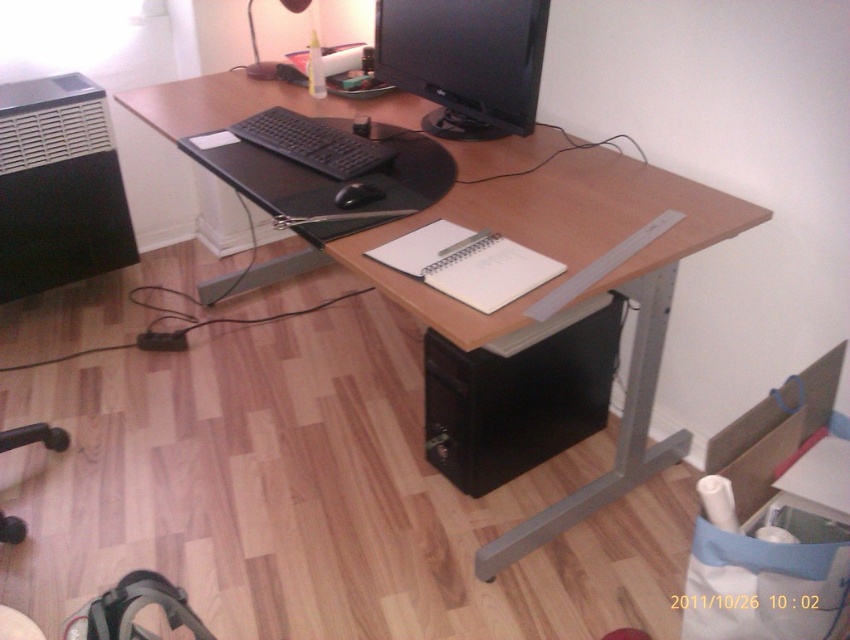
Question: Which object is positioned farthest from the wooden computer desk at center?

Choices:
 (A) black plastic swivel chair at lower left
 (B) black matte mouse at center

Answer: (A)

Question: Is the position of black plastic swivel chair at lower left less distant than that of black matte mouse at center?

Choices:
 (A) no
 (B) yes

Answer: (A)

Question: Which of the following is the farthest from the observer?

Choices:
 (A) black plastic swivel chair at lower left
 (B) black glossy monitor at upper center

Answer: (A)

Question: Estimate the real-world distances between objects in this image. Which object is farther from the black plastic swivel chair at lower left?

Choices:
 (A) black matte mouse at center
 (B) black glossy monitor at upper center

Answer: (B)

Question: Is wooden computer desk at center thinner than matte black lamp at upper center?

Choices:
 (A) yes
 (B) no

Answer: (B)

Question: Is wooden computer desk at center positioned at the back of black matte keyboard at center?

Choices:
 (A) yes
 (B) no

Answer: (B)